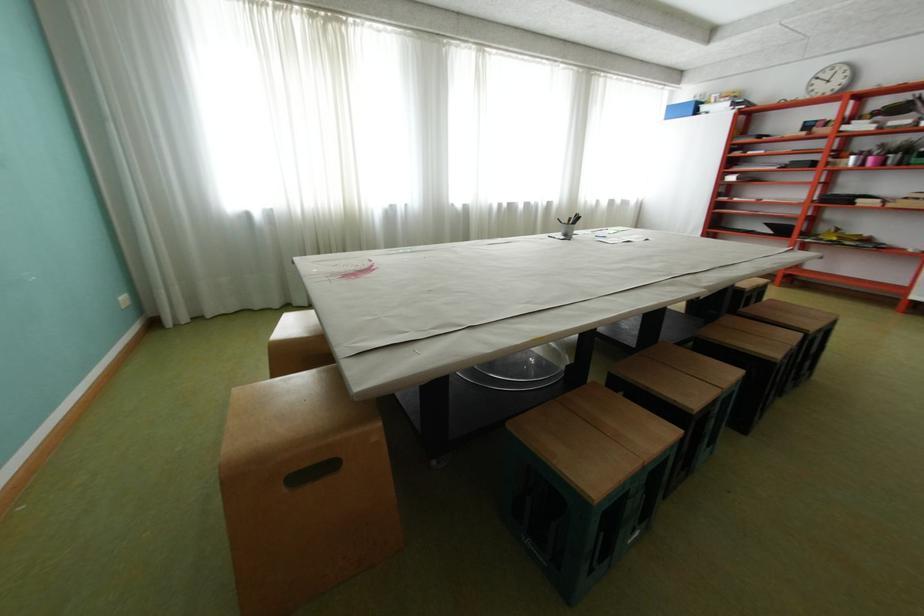
Find where to push the clear plastic bowl. Please return your answer as a coordinate pair (x, y).

(520, 369)